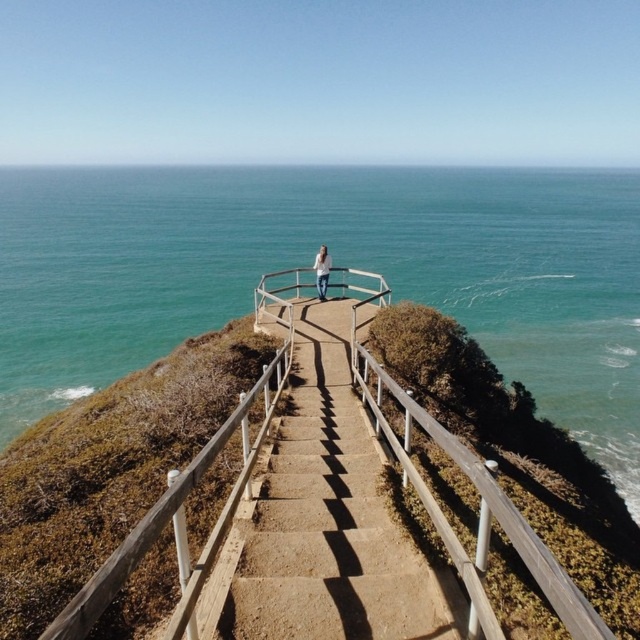
Does blue water at upper center have a lesser height compared to brown concrete stairs at center?

In fact, blue water at upper center may be taller than brown concrete stairs at center.

Is point (124, 237) positioned after point (342, 355)?

Yes, it is.

You are a GUI agent. You are given a task and a screenshot of the screen. Output one action in this format:
    pyautogui.click(x=<x>, y=<y>)
    Task: Click on the blue water at upper center
    
    Given the screenshot: What is the action you would take?
    pyautogui.click(x=333, y=264)

Does blue water at upper center appear under white cotton shirt at center?

Incorrect, blue water at upper center is not positioned below white cotton shirt at center.

Does blue water at upper center have a smaller size compared to white cotton shirt at center?

No, blue water at upper center is not smaller than white cotton shirt at center.

Locate an element on the screen. blue water at upper center is located at coordinates (333, 264).

Is brown concrete stairs at center taller than white cotton shirt at center?

No.

Who is more distant from viewer, (298, 358) or (320, 268)?

The point (320, 268) is more distant.

Image resolution: width=640 pixels, height=640 pixels. Identify the location of brown concrete stairs at center. (332, 518).

The image size is (640, 640). I want to click on brown concrete stairs at center, so click(x=332, y=518).